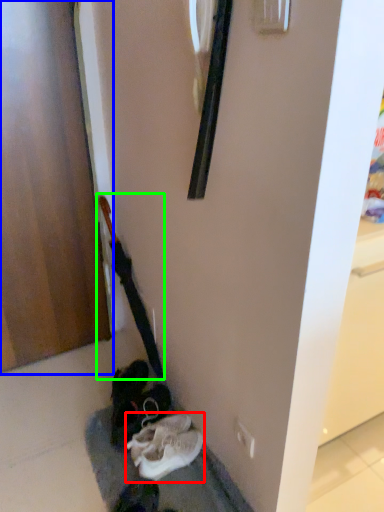
Question: Based on their relative distances, which object is farther from footwear (highlighted by a red box)? Choose from door (highlighted by a blue box) and guitar (highlighted by a green box).

Choices:
 (A) door
 (B) guitar

Answer: (A)